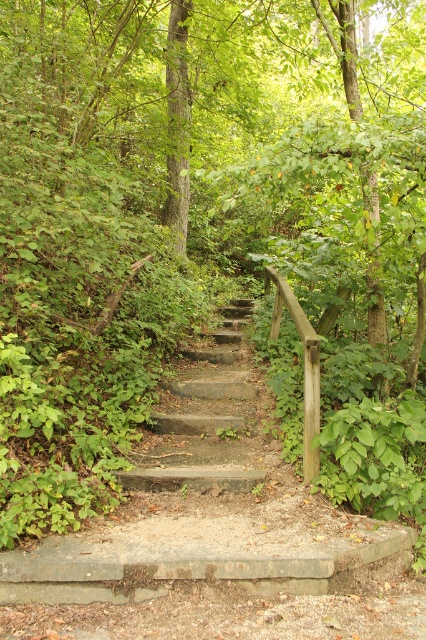
Is concrete steps at center above gray concrete stairs at center?

No, concrete steps at center is not above gray concrete stairs at center.

Which of these two, concrete steps at center or gray concrete stairs at center, stands shorter?

Standing shorter between the two is gray concrete stairs at center.

Locate an element on the screen. Image resolution: width=426 pixels, height=640 pixels. concrete steps at center is located at coordinates coord(207,513).